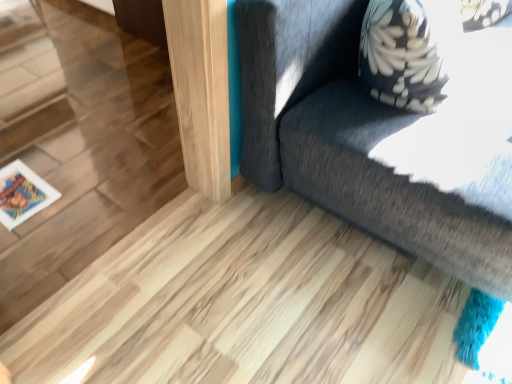
At what (x,y) coordinates should I click in order to perform the action: click on wooden frame at lower left. Please return your answer as a coordinate pair (x, y). This screenshot has height=384, width=512. Looking at the image, I should click on (22, 194).

What do you see at coordinates (22, 194) in the screenshot? The width and height of the screenshot is (512, 384). I see `wooden frame at lower left` at bounding box center [22, 194].

Describe the element at coordinates (379, 139) in the screenshot. I see `dark gray fabric couch at upper right` at that location.

Where is `dark gray fabric couch at upper right`? This screenshot has height=384, width=512. dark gray fabric couch at upper right is located at coordinates (379, 139).

What is the approximate height of dark gray fabric couch at upper right?

dark gray fabric couch at upper right is 34.04 inches tall.

Image resolution: width=512 pixels, height=384 pixels. In order to click on wooden frame at lower left in this screenshot , I will do `click(22, 194)`.

Considering the relative positions of dark gray fabric couch at upper right and wooden frame at lower left in the image provided, is dark gray fabric couch at upper right to the left of wooden frame at lower left from the viewer's perspective?

In fact, dark gray fabric couch at upper right is to the right of wooden frame at lower left.

Based on the photo, considering their positions, is dark gray fabric couch at upper right located in front of or behind wooden frame at lower left?

Clearly, dark gray fabric couch at upper right is in front of wooden frame at lower left.

Does point (489, 53) come farther from viewer compared to point (4, 209)?

That is True.

From the image's perspective, is dark gray fabric couch at upper right on wooden frame at lower left?

Yes, from the image's perspective, dark gray fabric couch at upper right is on top of wooden frame at lower left.

From a real-world perspective, is dark gray fabric couch at upper right physically above wooden frame at lower left?

Yes.

Looking at their sizes, would you say dark gray fabric couch at upper right is wider or thinner than wooden frame at lower left?

In the image, dark gray fabric couch at upper right appears to be wider than wooden frame at lower left.

Consider the image. Between dark gray fabric couch at upper right and wooden frame at lower left, which one has less height?

wooden frame at lower left is shorter.

Considering the relative sizes of dark gray fabric couch at upper right and wooden frame at lower left in the image provided, is dark gray fabric couch at upper right bigger than wooden frame at lower left?

Indeed, dark gray fabric couch at upper right has a larger size compared to wooden frame at lower left.

In the scene shown: Is dark gray fabric couch at upper right situated inside wooden frame at lower left or outside?

dark gray fabric couch at upper right cannot be found inside wooden frame at lower left.

Is dark gray fabric couch at upper right beside wooden frame at lower left?

They are not placed beside each other.

Is dark gray fabric couch at upper right turned away from wooden frame at lower left?

dark gray fabric couch at upper right is not turned away from wooden frame at lower left.

How different are the orientations of dark gray fabric couch at upper right and wooden frame at lower left in degrees?

The angular difference between dark gray fabric couch at upper right and wooden frame at lower left is 0.000294 degrees.

From the picture: Measure the distance between dark gray fabric couch at upper right and wooden frame at lower left.

dark gray fabric couch at upper right and wooden frame at lower left are 1.08 meters apart from each other.

I want to click on furniture that is above the wooden frame at lower left (from the image's perspective), so click(379, 139).

Which object is positioned more to the left, wooden frame at lower left or dark gray fabric couch at upper right?

Positioned to the left is wooden frame at lower left.

Considering the positions of objects wooden frame at lower left and dark gray fabric couch at upper right in the image provided, who is behind, wooden frame at lower left or dark gray fabric couch at upper right?

wooden frame at lower left is behind.

Considering the positions of points (8, 188) and (478, 117), is point (8, 188) closer to camera compared to point (478, 117)?

No, it is behind (478, 117).

From the image's perspective, is wooden frame at lower left located above dark gray fabric couch at upper right?

Incorrect, from the image's perspective, wooden frame at lower left is lower than dark gray fabric couch at upper right.

From a real-world perspective, which object rests below the other?

wooden frame at lower left is physically lower.

Considering the relative sizes of wooden frame at lower left and dark gray fabric couch at upper right in the image provided, is wooden frame at lower left thinner than dark gray fabric couch at upper right?

Yes, wooden frame at lower left is thinner than dark gray fabric couch at upper right.

Which of these two, wooden frame at lower left or dark gray fabric couch at upper right, stands shorter?

Standing shorter between the two is wooden frame at lower left.

Which of these two, wooden frame at lower left or dark gray fabric couch at upper right, is smaller?

wooden frame at lower left.

Choose the correct answer: Is wooden frame at lower left inside dark gray fabric couch at upper right or outside it?

wooden frame at lower left is spatially situated outside dark gray fabric couch at upper right.

Are wooden frame at lower left and dark gray fabric couch at upper right making contact?

They are not placed beside each other.

Is wooden frame at lower left oriented towards dark gray fabric couch at upper right?

No.

How many degrees apart are the facing directions of wooden frame at lower left and dark gray fabric couch at upper right?

They differ by 0.000294 degrees in their facing directions.

What are the coordinates of `picture frame lying below the dark gray fabric couch at upper right (from the image's perspective)` in the screenshot? It's located at (22, 194).

Locate an element on the screen. Image resolution: width=512 pixels, height=384 pixels. picture frame on the left of dark gray fabric couch at upper right is located at coordinates (22, 194).

Find the location of a particular element. Image resolution: width=512 pixels, height=384 pixels. furniture that is above the wooden frame at lower left (from a real-world perspective) is located at coordinates (379, 139).